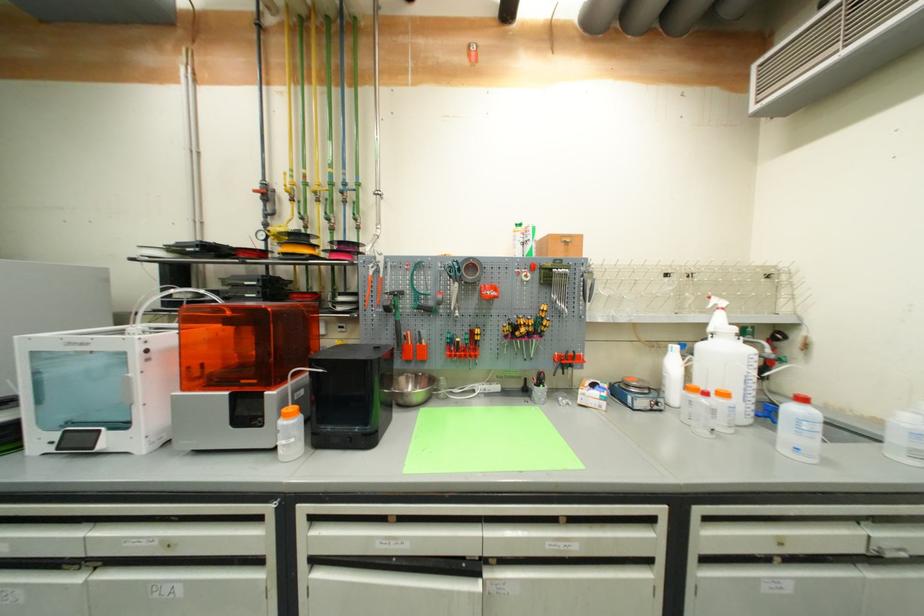
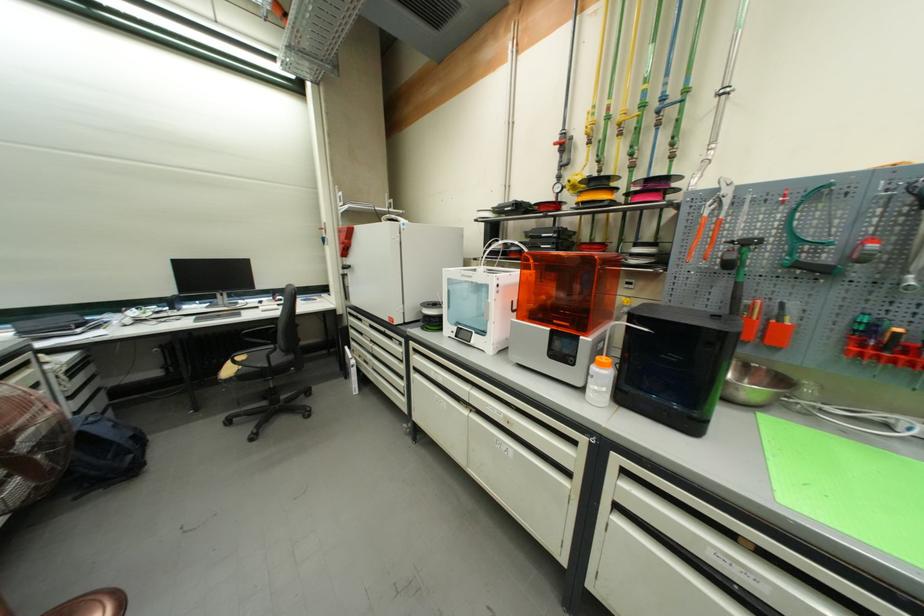
The point at (x=325, y=371) is marked in the first image. Where is the corresponding point in the second image?

(651, 331)